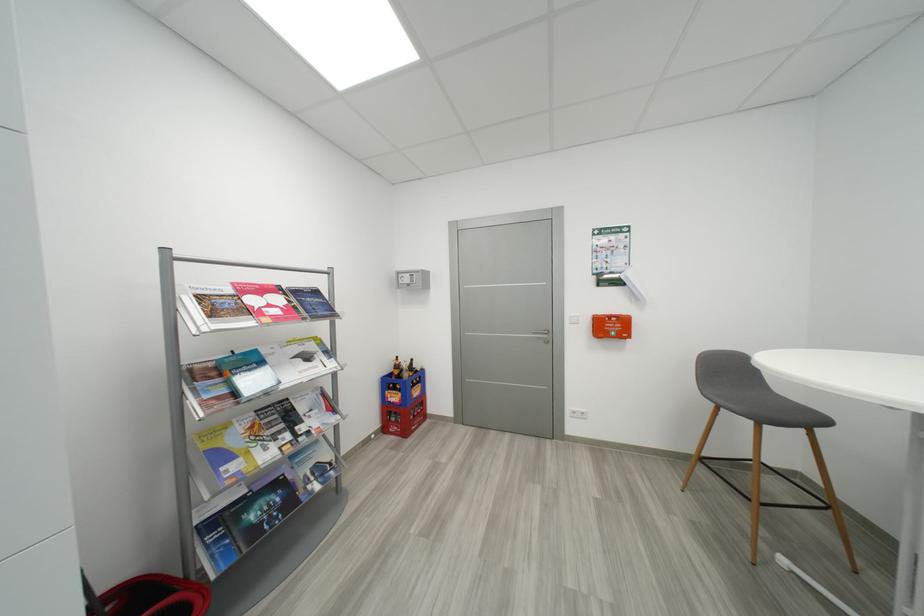
Where is `chair sitting surface`? chair sitting surface is located at coordinates (764, 406).